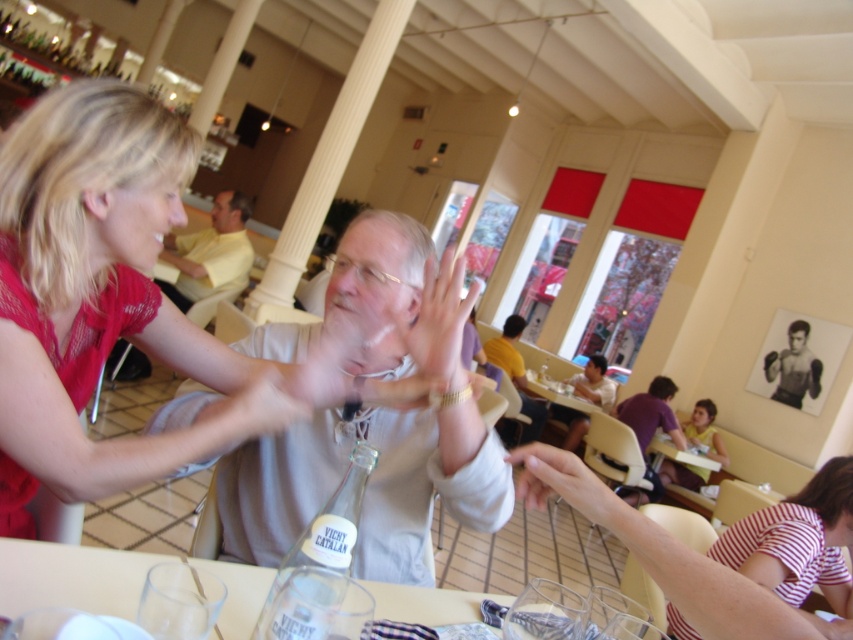
Question: Which of the following is the farthest from the observer?

Choices:
 (A) (572, 396)
 (B) (444, 337)

Answer: (A)

Question: Does matte pink blouse at upper left come behind striped cotton shirt at lower right?

Choices:
 (A) yes
 (B) no

Answer: (B)

Question: Among these points, which one is farthest from the camera?

Choices:
 (A) (706, 552)
 (B) (12, 195)

Answer: (A)

Question: Where is purple cotton shirt at lower right located in relation to wooden table at center in the image?

Choices:
 (A) left
 (B) right

Answer: (B)

Question: Which object is the farthest from the smooth white hand at center?

Choices:
 (A) light brown leather jacket at center
 (B) smooth white shirt at center

Answer: (B)

Question: Can you confirm if matte yellow shirt at lower right is bigger than wooden table at center?

Choices:
 (A) yes
 (B) no

Answer: (B)